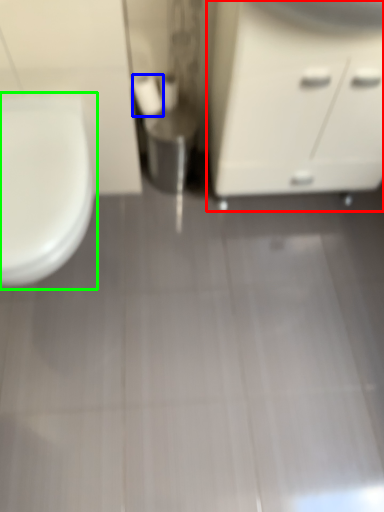
Question: Which object is positioned closest to bathroom cabinet (highlighted by a red box)? Select from toilet paper (highlighted by a blue box) and toilet (highlighted by a green box).

Choices:
 (A) toilet paper
 (B) toilet

Answer: (A)